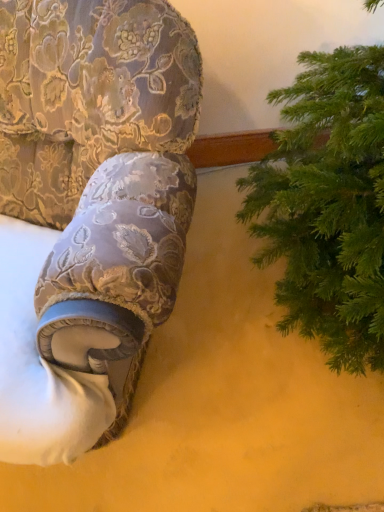
Question: Should I look upward or downward to see velvet floral-patterned armchair at left?

Choices:
 (A) up
 (B) down

Answer: (A)